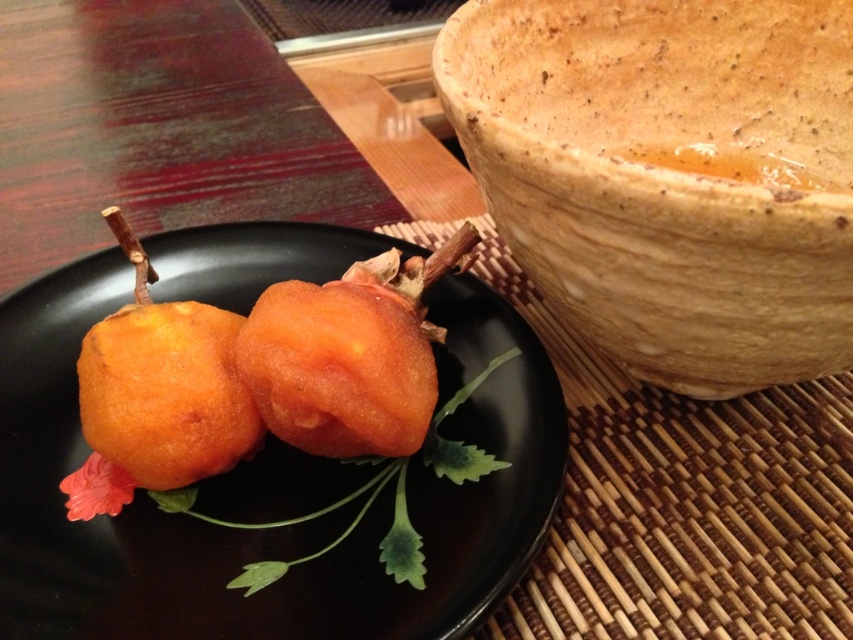
Does speckled clay bowl at upper right appear on the right side of orange matte/powdery fruit at center?

Correct, you'll find speckled clay bowl at upper right to the right of orange matte/powdery fruit at center.

Is speckled clay bowl at upper right behind orange matte/powdery fruit at center?

No, speckled clay bowl at upper right is closer to the viewer.

Does point (796, 145) lie in front of point (236, 472)?

No.

What are the coordinates of `speckled clay bowl at upper right` in the screenshot? It's located at (668, 173).

Measure the distance between point (627, 216) and camera.

Point (627, 216) and camera are 24.29 inches apart from each other.

Between speckled clay bowl at upper right and golden fried donut at center, which one has more height?

With more height is speckled clay bowl at upper right.

Does point (502, 132) lie in front of point (136, 476)?

Yes, point (502, 132) is in front of point (136, 476).

What are the coordinates of `speckled clay bowl at upper right` in the screenshot? It's located at (668, 173).

Can you confirm if orange matte/powdery fruit at center is shorter than orange matte fruit at center?

Incorrect, orange matte/powdery fruit at center's height does not fall short of orange matte fruit at center's.

The width and height of the screenshot is (853, 640). Describe the element at coordinates (271, 529) in the screenshot. I see `orange matte/powdery fruit at center` at that location.

What are the coordinates of `orange matte/powdery fruit at center` in the screenshot? It's located at coord(271,529).